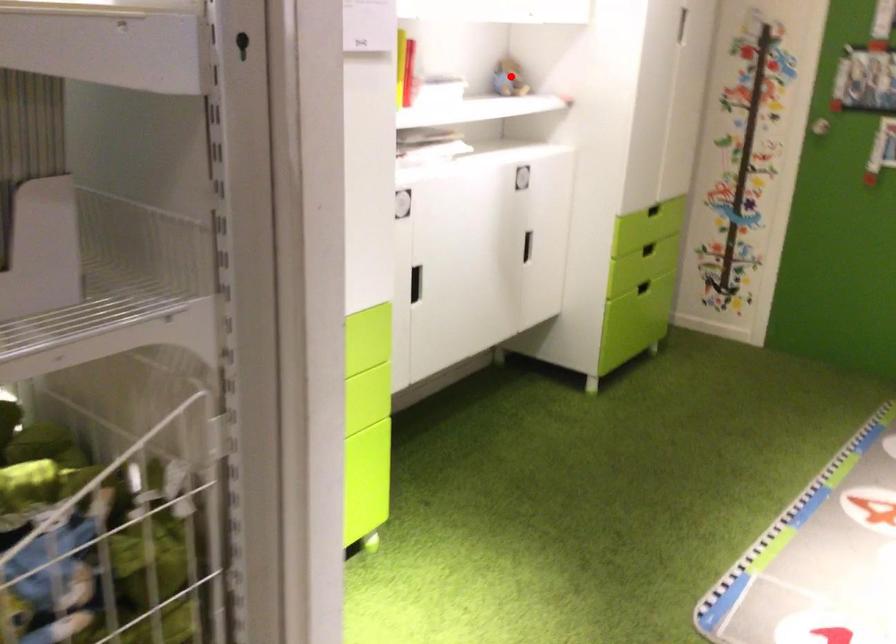
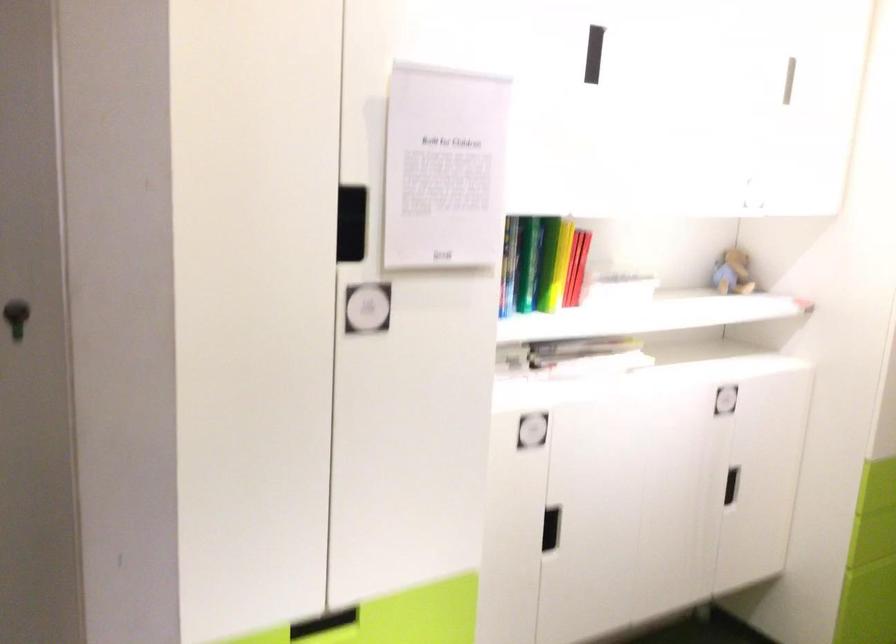
Question: I am providing you with two images of the same scene from different viewpoints. In image1, a red point is highlighted. Considering the same 3D point in image2, which of the following is correct?

Choices:
 (A) It is closer
 (B) It is farther

Answer: (A)